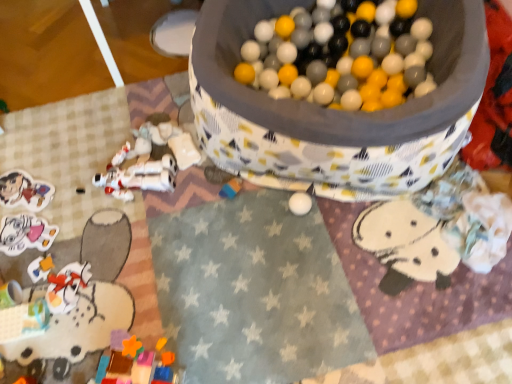
Where is `spots to the right of matte white sticker at lower left, the 5th toy when ordered from right to left`? spots to the right of matte white sticker at lower left, the 5th toy when ordered from right to left is located at coordinates (84, 236).